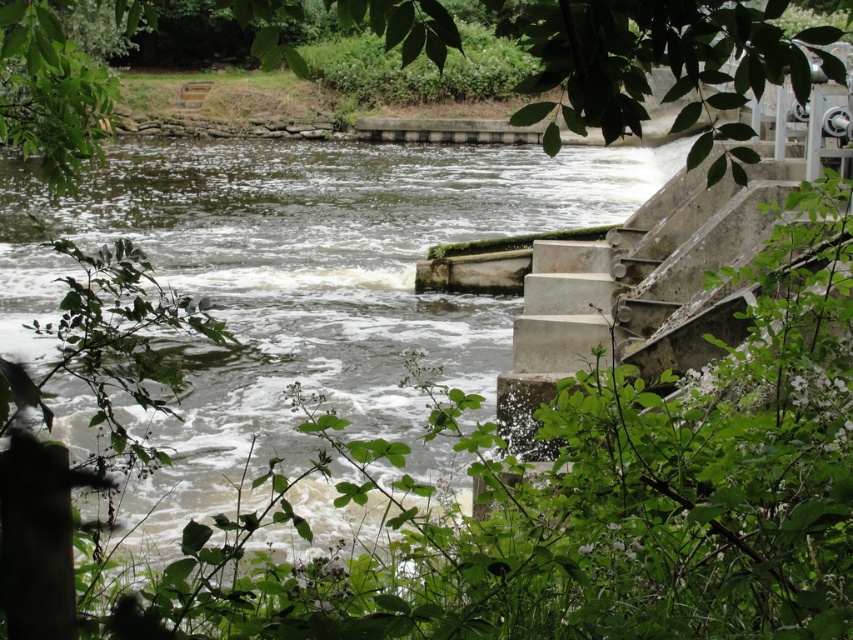
Question: Which is farther from the concrete stairs at right?

Choices:
 (A) green leafy tree at upper left
 (B) green leafy tree at upper center

Answer: (B)

Question: Does dark green concrete river at center appear over concrete stairs at right?

Choices:
 (A) yes
 (B) no

Answer: (A)

Question: Is dark green concrete river at center smaller than green leafy tree at upper left?

Choices:
 (A) no
 (B) yes

Answer: (A)

Question: Does green leafy tree at upper center have a smaller size compared to concrete stairs at right?

Choices:
 (A) no
 (B) yes

Answer: (A)

Question: Which object is positioned farthest from the green leafy tree at upper center?

Choices:
 (A) dark green concrete river at center
 (B) concrete stairs at right

Answer: (B)

Question: Which point is closer to the camera taking this photo?

Choices:
 (A) (730, 202)
 (B) (12, 141)
 (C) (405, 337)
 (D) (548, 10)

Answer: (D)